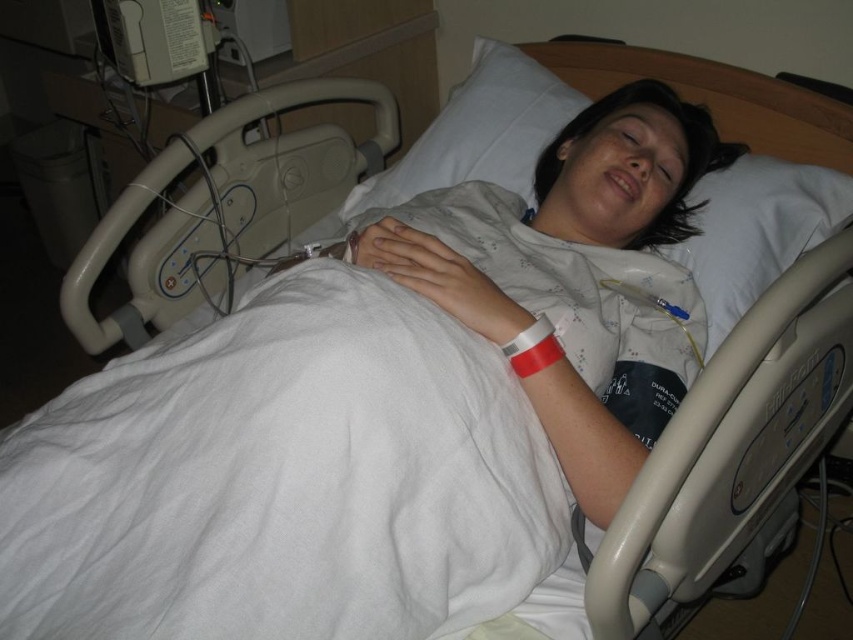
Measure the distance from white matte wristband at center to red matte wristband at center.

white matte wristband at center and red matte wristband at center are 3.89 inches apart.

This screenshot has height=640, width=853. Describe the element at coordinates (584, 440) in the screenshot. I see `white matte wristband at center` at that location.

Between point (587, 493) and point (555, 337), which one is positioned in front?

Point (587, 493) is in front.

The height and width of the screenshot is (640, 853). In order to click on white matte wristband at center in this screenshot , I will do `click(584, 440)`.

In the scene shown: Between white matte wristband at center and white fabric pillow at upper center, which one is positioned higher?

white fabric pillow at upper center

This screenshot has width=853, height=640. What are the coordinates of `white matte wristband at center` in the screenshot? It's located at (584, 440).

Between white fabric pillow at upper center and red matte wristband at center, which one appears on the left side from the viewer's perspective?

Positioned to the left is white fabric pillow at upper center.

Between white fabric pillow at upper center and red matte wristband at center, which one is positioned higher?

Positioned higher is white fabric pillow at upper center.

Does point (341, 209) come farther from viewer compared to point (517, 372)?

Yes, point (341, 209) is behind point (517, 372).

The width and height of the screenshot is (853, 640). I want to click on white fabric pillow at upper center, so click(479, 131).